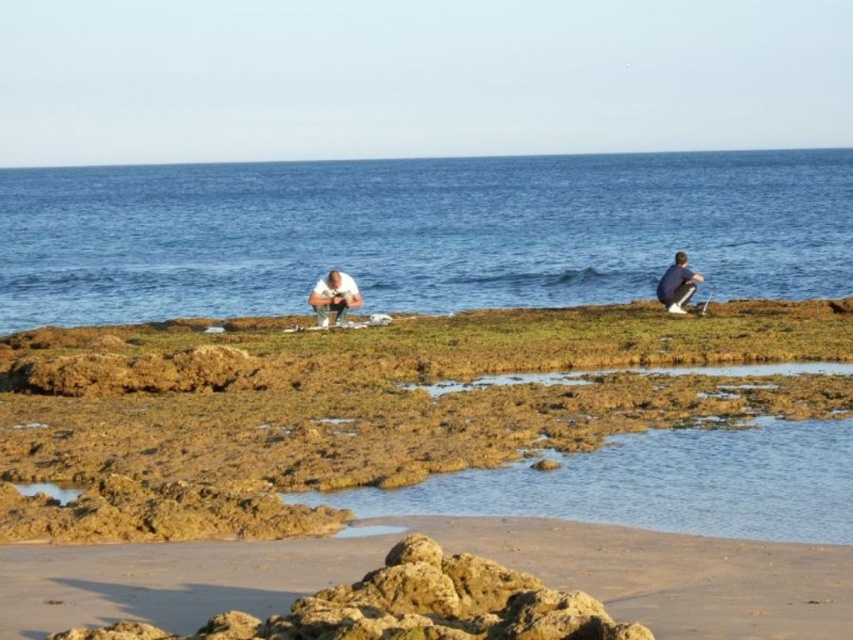
Is light brown leather jacket at center wider than dark blue fabric shirt at right?

Yes.

Is light brown leather jacket at center behind dark blue fabric shirt at right?

No, light brown leather jacket at center is closer to the viewer.

Who is more distant from viewer, (x=354, y=301) or (x=666, y=298)?

Positioned behind is point (x=666, y=298).

Image resolution: width=853 pixels, height=640 pixels. Find the location of `light brown leather jacket at center`. light brown leather jacket at center is located at coordinates click(334, 298).

Which is below, blue water at center or light brown leather jacket at center?

Positioned lower is light brown leather jacket at center.

Can you confirm if blue water at center is smaller than light brown leather jacket at center?

No, blue water at center is not smaller than light brown leather jacket at center.

I want to click on blue water at center, so click(416, 232).

From the picture: Is blue water at center to the left of dark blue fabric shirt at right from the viewer's perspective?

Yes, blue water at center is to the left of dark blue fabric shirt at right.

Does point (634, 275) lie behind point (692, 284)?

That is True.

Which is behind, point (299, 170) or point (682, 257)?

Positioned behind is point (299, 170).

Image resolution: width=853 pixels, height=640 pixels. I want to click on blue water at center, so click(x=416, y=232).